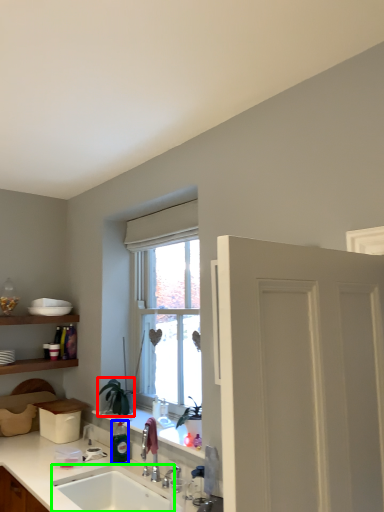
Question: Which object is positioned closest to plant (highlighted by a red box)? Select from bottle (highlighted by a blue box) and sink (highlighted by a green box).

Choices:
 (A) bottle
 (B) sink

Answer: (A)